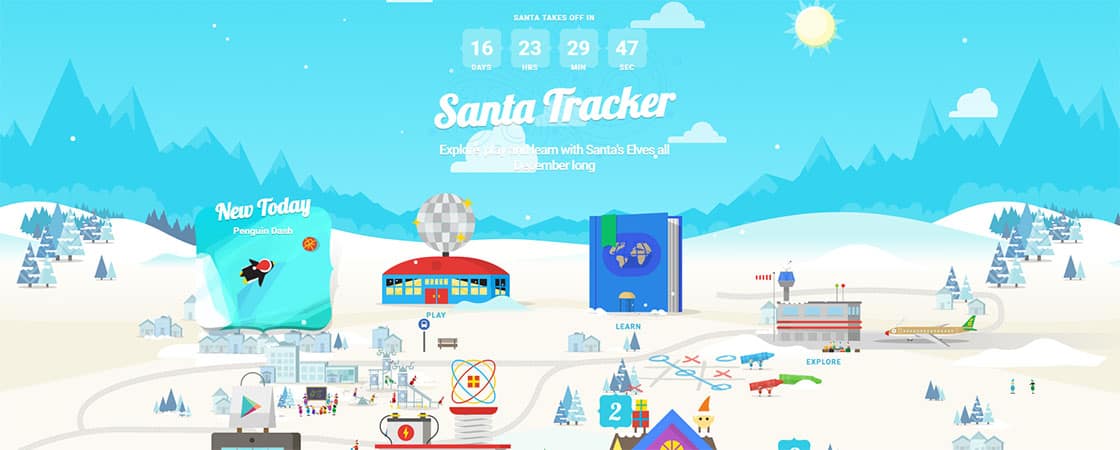
Locate an element on the screen. book is located at coordinates (620, 259).